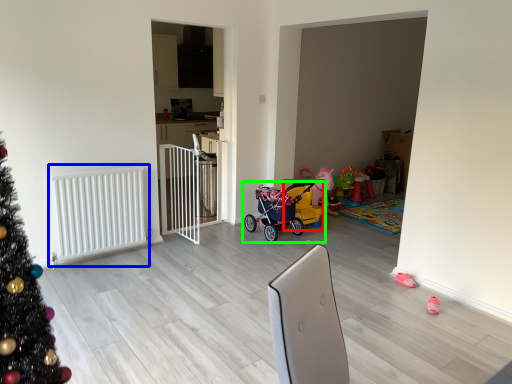
Question: Which object is positioned farthest from baby carriage (highlighted by a red box)? Select from radiator (highlighted by a blue box) and toy (highlighted by a green box).

Choices:
 (A) radiator
 (B) toy

Answer: (A)